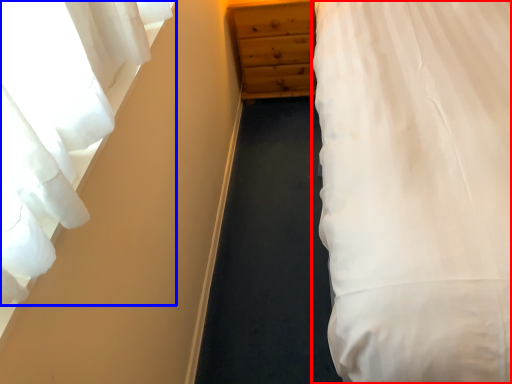
Question: Which of the following is the farthest to the observer, bed (highlighted by a red box) or curtain (highlighted by a blue box)?

Choices:
 (A) bed
 (B) curtain

Answer: (B)